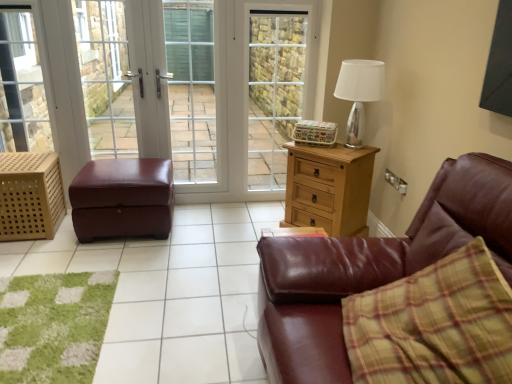
Question: From a real-world perspective, is clear glass door at center below brown leather ottoman at center?

Choices:
 (A) no
 (B) yes

Answer: (A)

Question: Is clear glass door at center shorter than brown leather ottoman at center?

Choices:
 (A) yes
 (B) no

Answer: (B)

Question: Does clear glass door at center lie in front of brown leather ottoman at center?

Choices:
 (A) no
 (B) yes

Answer: (A)

Question: From a real-world perspective, does clear glass door at center stand above brown leather ottoman at center?

Choices:
 (A) yes
 (B) no

Answer: (A)

Question: From the image's perspective, would you say clear glass door at center is positioned over brown leather ottoman at center?

Choices:
 (A) yes
 (B) no

Answer: (A)

Question: From a real-world perspective, is wooden lattice basket at left physically located above or below matte white screen door at center, the 2th screen door positioned from the right?

Choices:
 (A) above
 (B) below

Answer: (B)

Question: Does point (4, 157) appear closer or farther from the camera than point (184, 147)?

Choices:
 (A) farther
 (B) closer

Answer: (B)

Question: Looking at the image, does wooden lattice basket at left seem bigger or smaller compared to matte white screen door at center, the 2th screen door positioned from the right?

Choices:
 (A) big
 (B) small

Answer: (A)

Question: Is wooden lattice basket at left wider or thinner than matte white screen door at center, the first screen door positioned from the left?

Choices:
 (A) thin
 (B) wide

Answer: (B)

Question: Considering the positions of point (262, 97) and point (112, 112), is point (262, 97) closer or farther from the camera than point (112, 112)?

Choices:
 (A) farther
 (B) closer

Answer: (A)

Question: Is clear glass screen door at center, the 2th screen door viewed from the left, inside or outside of clear glass door at center?

Choices:
 (A) outside
 (B) inside

Answer: (A)

Question: Considering the relative positions of clear glass screen door at center, which is the 1th screen door in right-to-left order, and clear glass door at center in the image provided, is clear glass screen door at center, which is the 1th screen door in right-to-left order, to the left or to the right of clear glass door at center?

Choices:
 (A) right
 (B) left

Answer: (A)

Question: From the image's perspective, is clear glass screen door at center, the 2th screen door viewed from the left, above or below clear glass door at center?

Choices:
 (A) above
 (B) below

Answer: (B)

Question: In the image, is clear glass screen door at center, which is the 1th screen door in right-to-left order, positioned in front of or behind light brown wooden chest of drawers at center right?

Choices:
 (A) front
 (B) behind

Answer: (B)

Question: Considering the relative positions of clear glass screen door at center, which is the 1th screen door in right-to-left order, and light brown wooden chest of drawers at center right in the image provided, is clear glass screen door at center, which is the 1th screen door in right-to-left order, to the left or to the right of light brown wooden chest of drawers at center right?

Choices:
 (A) left
 (B) right

Answer: (A)